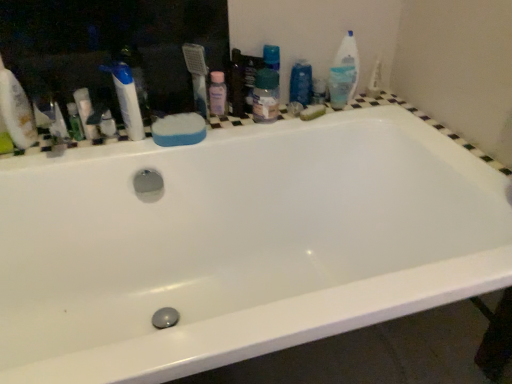
At what (x,y) coordinates should I click in order to perform the action: click on empty space that is to the right of translucent plastic bottle at upper right, positioned as the second cleaning product in bottom-to-top order. Please return your answer as a coordinate pair (x, y). Looking at the image, I should click on (374, 100).